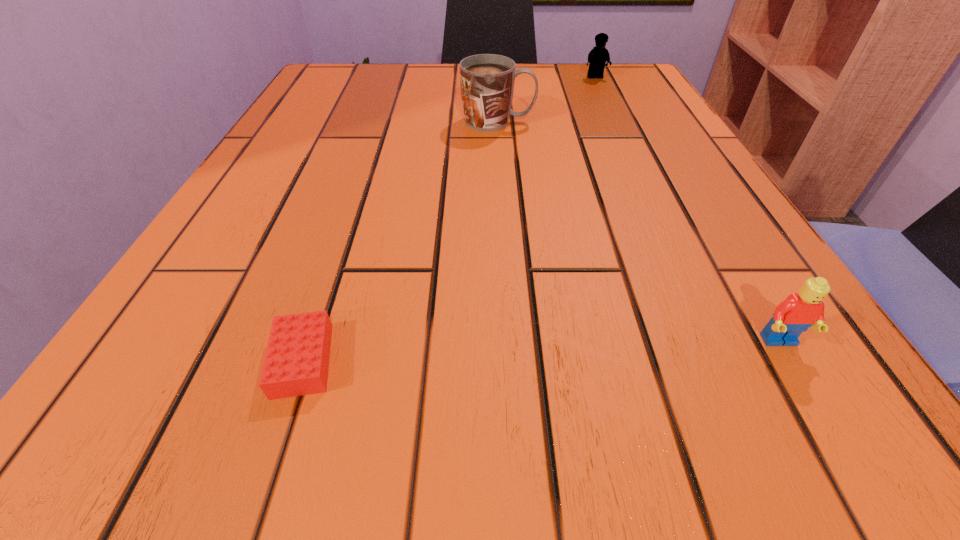
You are a GUI agent. You are given a task and a screenshot of the screen. Output one action in this format:
    pyautogui.click(x=<x>, y=<y>)
    Task: Click on the vacant space at the far left corner of the desktop
    Image resolution: width=960 pixels, height=540 pixels.
    Given the screenshot: What is the action you would take?
    pyautogui.click(x=368, y=76)

In the image, there is a desktop. Identify the location of free space at the far right corner. This screenshot has width=960, height=540. (634, 93).

In order to click on free point between the mug and the leftmost Lego in this screenshot , I will do `click(400, 241)`.

Locate an element on the screen. vacant region between the third nearest object and the shortest object is located at coordinates (400, 241).

This screenshot has height=540, width=960. I want to click on free space that is in between the second Lego from left to right and the rightmost object, so click(x=687, y=210).

Locate an element on the screen. This screenshot has width=960, height=540. vacant area between the farthest Lego and the mug is located at coordinates (546, 99).

The height and width of the screenshot is (540, 960). Find the location of `vacant region between the leftmost Lego and the mug`. vacant region between the leftmost Lego and the mug is located at coordinates (400, 241).

Find the location of `free spot between the second farthest object and the second object from right to left`. free spot between the second farthest object and the second object from right to left is located at coordinates (546, 99).

You are a GUI agent. You are given a task and a screenshot of the screen. Output one action in this format:
    pyautogui.click(x=<x>, y=<y>)
    Task: Click on the free space that is in between the second object from right to left and the rightmost object
    The height and width of the screenshot is (540, 960).
    Given the screenshot: What is the action you would take?
    pyautogui.click(x=687, y=210)

Find the location of a particular element. The height and width of the screenshot is (540, 960). free spot between the rightmost object and the second object from left to right is located at coordinates (638, 232).